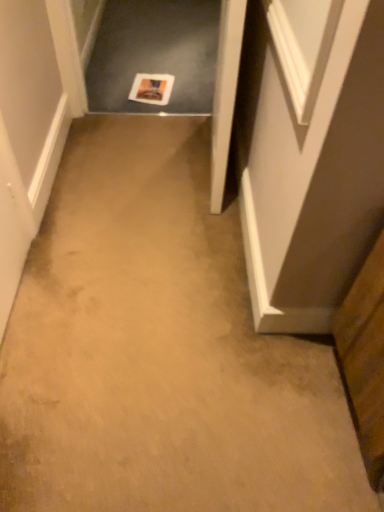
Question: Is white paper at center next to white wood door at center and touching it?

Choices:
 (A) no
 (B) yes

Answer: (A)

Question: Can you confirm if white paper at center is smaller than white wood door at center?

Choices:
 (A) no
 (B) yes

Answer: (B)

Question: Can you confirm if white paper at center is bigger than white wood door at center?

Choices:
 (A) yes
 (B) no

Answer: (B)

Question: Considering the relative sizes of white paper at center and white wood door at center in the image provided, is white paper at center thinner than white wood door at center?

Choices:
 (A) yes
 (B) no

Answer: (B)

Question: Is white wood door at center located within white paper at center?

Choices:
 (A) yes
 (B) no

Answer: (B)

Question: From the image's perspective, is white paper at center above or below white wood door at center?

Choices:
 (A) above
 (B) below

Answer: (A)

Question: From a real-world perspective, is white paper at center physically located above or below white wood door at center?

Choices:
 (A) below
 (B) above

Answer: (A)

Question: In terms of height, does white paper at center look taller or shorter compared to white wood door at center?

Choices:
 (A) short
 (B) tall

Answer: (A)

Question: Is white paper at center inside the boundaries of white wood door at center, or outside?

Choices:
 (A) inside
 (B) outside

Answer: (B)

Question: From the image's perspective, relative to wooden cabinet at lower right, is white wood door at center above or below?

Choices:
 (A) below
 (B) above

Answer: (B)

Question: Considering the positions of white wood door at center and wooden cabinet at lower right in the image, is white wood door at center wider or thinner than wooden cabinet at lower right?

Choices:
 (A) thin
 (B) wide

Answer: (A)

Question: In terms of height, does white wood door at center look taller or shorter compared to wooden cabinet at lower right?

Choices:
 (A) short
 (B) tall

Answer: (B)

Question: In the image, is white wood door at center on the left side or the right side of wooden cabinet at lower right?

Choices:
 (A) left
 (B) right

Answer: (A)

Question: In terms of width, does wooden cabinet at lower right look wider or thinner when compared to white wood door at center?

Choices:
 (A) wide
 (B) thin

Answer: (A)

Question: From the image's perspective, relative to white wood door at center, is wooden cabinet at lower right above or below?

Choices:
 (A) below
 (B) above

Answer: (A)